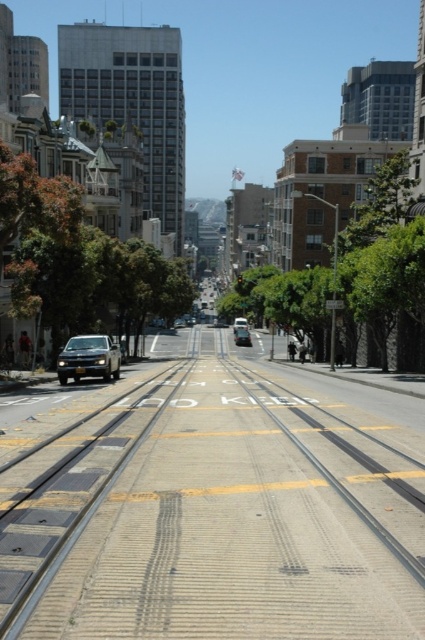
Is point (107, 342) positioned after point (243, 332)?

No.

Who is higher up, shiny silver suv at center or shiny silver sedan at center?

Positioned higher is shiny silver suv at center.

Does point (84, 352) lie behind point (238, 330)?

No, it is in front of (238, 330).

I want to click on shiny silver suv at center, so click(x=88, y=358).

Which is more to the left, yellow asphalt track at center or shiny silver suv at center?

shiny silver suv at center

Is point (124, 384) positioned behind point (62, 368)?

Yes.

Where is `yellow asphalt track at center`? yellow asphalt track at center is located at coordinates (212, 508).

Consider the image. Does shiny silver suv at center appear on the left side of metallic silver car at center?

Yes, shiny silver suv at center is to the left of metallic silver car at center.

Can you confirm if shiny silver suv at center is bigger than metallic silver car at center?

No.

Is point (90, 371) positioned before point (235, 326)?

That is True.

You are a GUI agent. You are given a task and a screenshot of the screen. Output one action in this format:
    pyautogui.click(x=<x>, y=<y>)
    Task: Click on the shiny silver suv at center
    
    Given the screenshot: What is the action you would take?
    pyautogui.click(x=88, y=358)